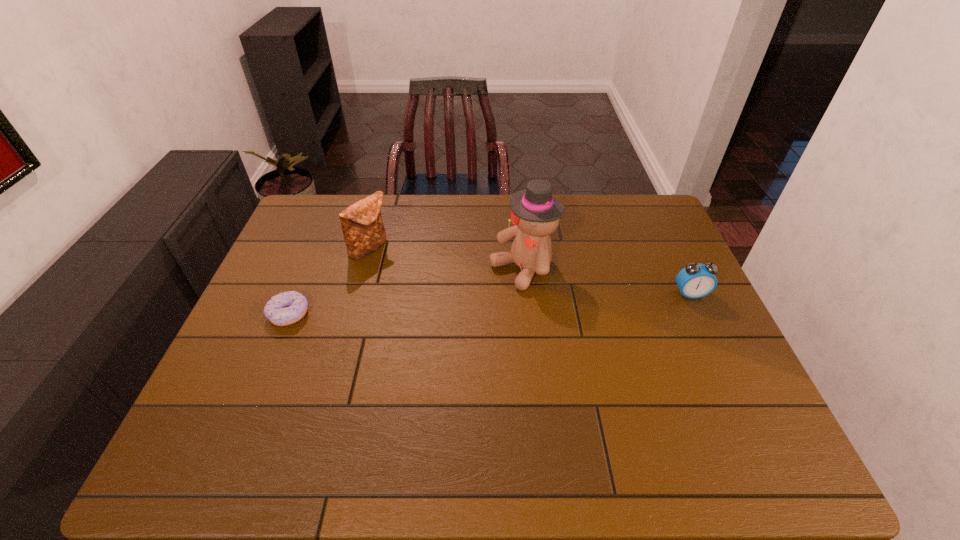
This screenshot has width=960, height=540. Find the location of `object that ranks as the third closest to the second shortest object`. object that ranks as the third closest to the second shortest object is located at coordinates (286, 308).

At what (x,y) coordinates should I click in order to perform the action: click on free space that satisfies the following two spatial constraints: 1. on the back side of the second object from left to right; 2. on the right side of the leftmost object. Please return your answer as a coordinate pair (x, y). Looking at the image, I should click on [x=316, y=249].